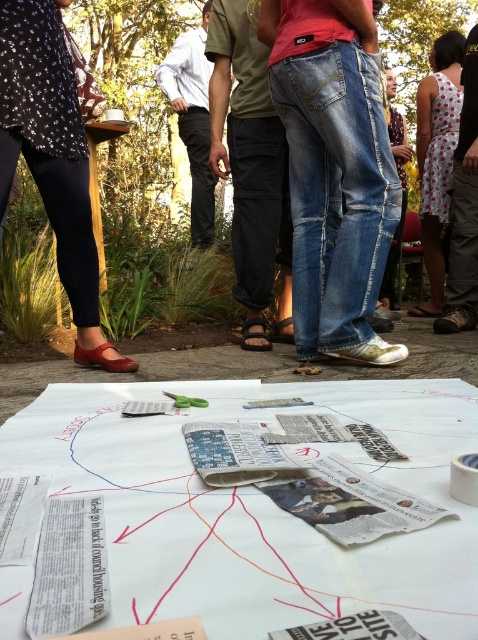
You are a photographer trying to capture a candid shot of the collaborative activity. You notice the denim jeans at center and the white dotted dress at center. Which person should you focus on to include both in the frame without moving your position?

You should focus on the white dotted dress at center because the denim jeans at center is positioned on the left side of it, so both will be in the frame if you center the white dotted dress.

You are a photographer trying to capture a clear shot of the jeans at center and the white dotted dress at lower right. Since you want both subjects in focus, which one should you focus on first to ensure the other is also in focus?

You should focus on the white dotted dress at lower right first because it is closer to the viewer than the jeans at center. By focusing on the closer subject, the farther one will also be in focus due to the depth of field.

You are a photographer trying to capture a candid shot of the collaborative activity. You need to ensure that both the white dotted dress at lower right and the jeans at center are in the frame. Given their distance apart, can you fit both subjects into a standard smartphone camera frame without moving closer or farther away?

The white dotted dress at lower right and jeans at center are 30.13 inches apart. A standard smartphone camera has a horizontal field of view of approximately 40 inches at this distance. Since the distance between them is less than the field of view, both subjects can be captured in the same frame without adjusting your position.